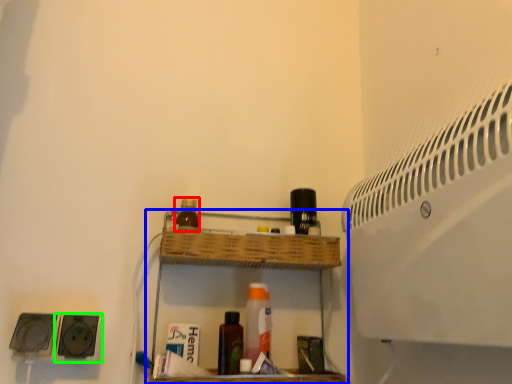
Question: Which object is positioned closest to bottle (highlighted by a red box)? Select from shelf (highlighted by a blue box) and speaker (highlighted by a green box).

Choices:
 (A) shelf
 (B) speaker

Answer: (A)